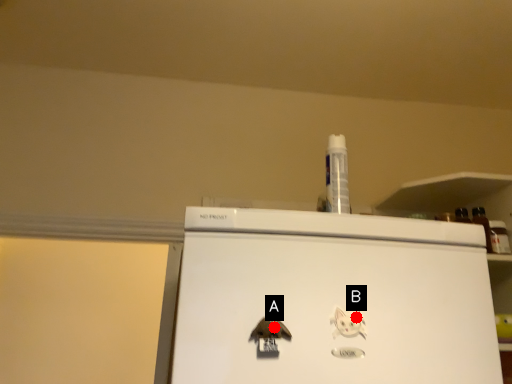
Question: Two points are circled on the image, labeled by A and B beside each circle. Among these points, which one is farthest from the camera?

Choices:
 (A) A is further
 (B) B is further

Answer: (B)